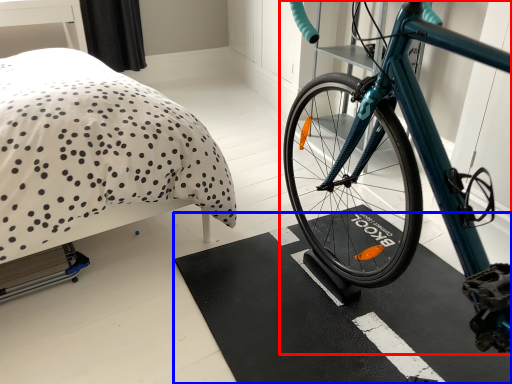
Question: Which point is further to the camera, bicycle (highlighted by a red box) or bath mat (highlighted by a blue box)?

Choices:
 (A) bicycle
 (B) bath mat

Answer: (B)